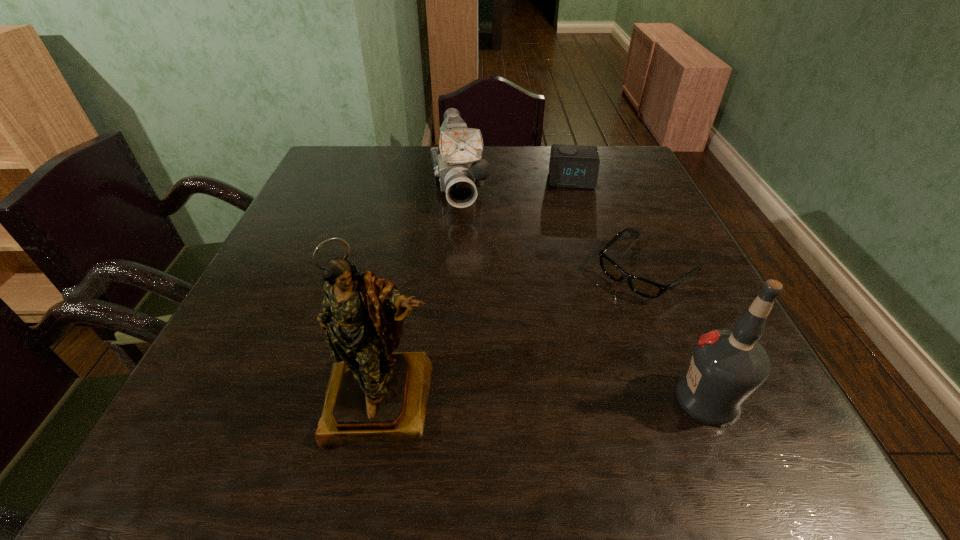
You are a GUI agent. You are given a task and a screenshot of the screen. Output one action in this format:
    pyautogui.click(x=<x>, y=<y>)
    Task: Click on the vacant space at the right edge of the desktop
    This screenshot has height=540, width=960.
    Given the screenshot: What is the action you would take?
    pyautogui.click(x=701, y=322)

This screenshot has height=540, width=960. I want to click on blank area at the far left corner, so click(350, 180).

Where is `vacant area at the far right corner`? The width and height of the screenshot is (960, 540). vacant area at the far right corner is located at coordinates (x=613, y=149).

Find the location of a particular element. vacant region between the figurine and the second shortest object is located at coordinates (477, 289).

At what (x,y) coordinates should I click in order to perform the action: click on free spot between the third tallest object and the alarm clock. Please return your answer as a coordinate pair (x, y). Looking at the image, I should click on (516, 182).

Locate an element on the screen. The height and width of the screenshot is (540, 960). vacant area between the second tallest object and the figurine is located at coordinates (545, 399).

Locate an element on the screen. This screenshot has height=540, width=960. vacant area that lies between the spectacles and the second tallest object is located at coordinates (678, 334).

Locate an element on the screen. free space between the shortest object and the alarm clock is located at coordinates (611, 224).

I want to click on vacant space in between the fourth shortest object and the figurine, so coord(545,399).

The height and width of the screenshot is (540, 960). Identify the location of unoccupied position between the spectacles and the fourth tallest object. (611, 224).